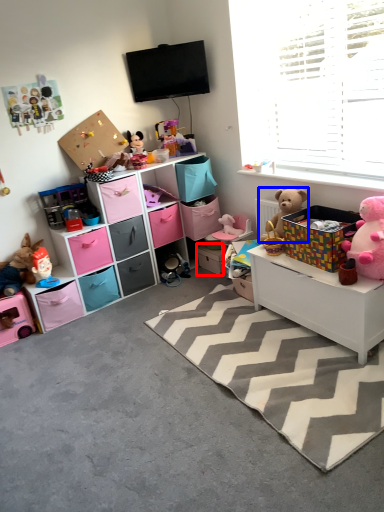
Question: Which point is closer to the camera, storage box (highlighted by a red box) or teddy bear (highlighted by a blue box)?

Choices:
 (A) storage box
 (B) teddy bear

Answer: (B)